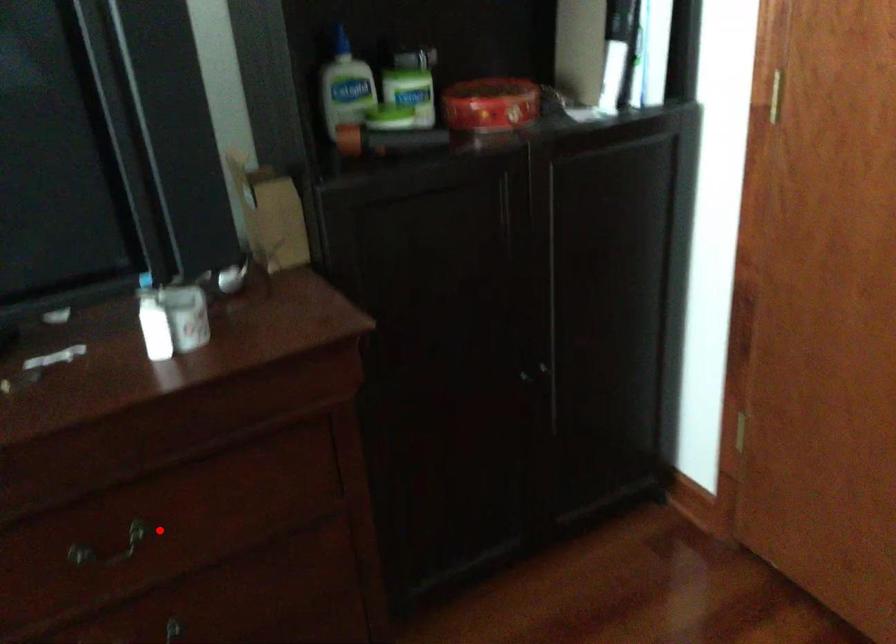
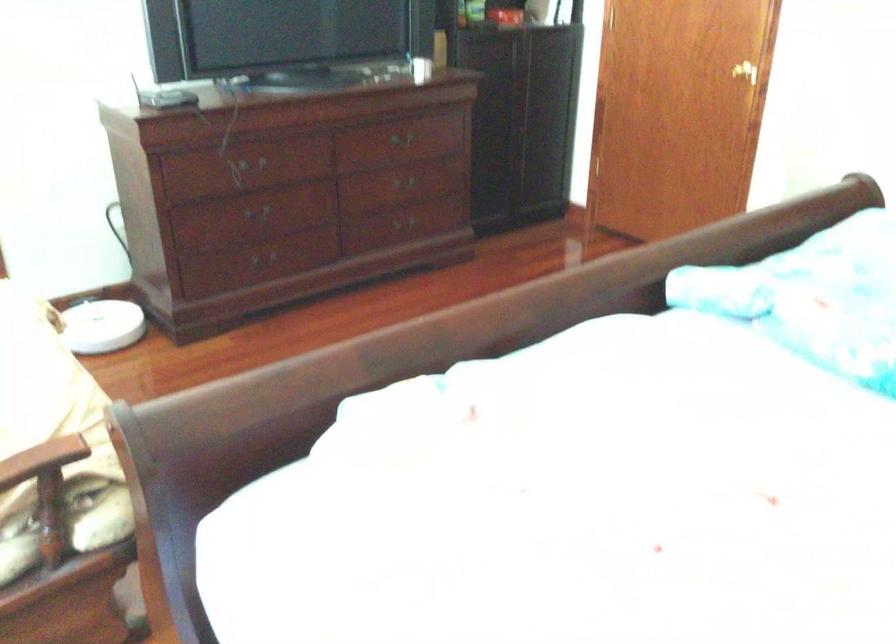
Question: I am providing you with two images of the same scene from different viewpoints. In image1, a red point is highlighted. Considering the same 3D point in image2, which of the following is correct?

Choices:
 (A) It is closer
 (B) It is farther

Answer: (B)